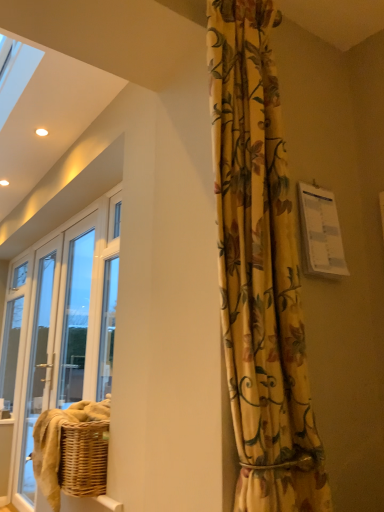
Identify the location of floral yellow curtain at center. This screenshot has height=512, width=384. (260, 269).

In order to face floral yellow curtain at center, should I rotate leftwards or rightwards?

Rotate your view right by about 7.946°.

What do you see at coordinates (260, 269) in the screenshot? Image resolution: width=384 pixels, height=512 pixels. I see `floral yellow curtain at center` at bounding box center [260, 269].

In order to click on clear glass screen door at left in this screenshot , I will do `click(39, 354)`.

What do you see at coordinates (39, 354) in the screenshot?
I see `clear glass screen door at left` at bounding box center [39, 354].

This screenshot has width=384, height=512. In order to click on floral yellow curtain at center in this screenshot , I will do `click(260, 269)`.

Considering the positions of objects clear glass screen door at left and floral yellow curtain at center in the image provided, who is more to the left, clear glass screen door at left or floral yellow curtain at center?

Positioned to the left is clear glass screen door at left.

Which is behind, clear glass screen door at left or floral yellow curtain at center?

Positioned behind is clear glass screen door at left.

Is point (31, 346) positioned after point (240, 220)?

Yes, it is behind point (240, 220).

From the image's perspective, which is above, clear glass screen door at left or floral yellow curtain at center?

From the image's view, floral yellow curtain at center is above.

From a real-world perspective, is clear glass screen door at left physically below floral yellow curtain at center?

Yes, from a real-world perspective, clear glass screen door at left is below floral yellow curtain at center.

Considering the relative sizes of clear glass screen door at left and floral yellow curtain at center in the image provided, is clear glass screen door at left thinner than floral yellow curtain at center?

Correct, the width of clear glass screen door at left is less than that of floral yellow curtain at center.

Considering the relative sizes of clear glass screen door at left and floral yellow curtain at center in the image provided, is clear glass screen door at left shorter than floral yellow curtain at center?

In fact, clear glass screen door at left may be taller than floral yellow curtain at center.

Considering the relative sizes of clear glass screen door at left and floral yellow curtain at center in the image provided, is clear glass screen door at left smaller than floral yellow curtain at center?

No.

Is clear glass screen door at left outside of floral yellow curtain at center?

clear glass screen door at left lies outside floral yellow curtain at center's area.

Is clear glass screen door at left far away from floral yellow curtain at center?

Yes, clear glass screen door at left is far from floral yellow curtain at center.

Is clear glass screen door at left aimed at floral yellow curtain at center?

No, clear glass screen door at left does not turn towards floral yellow curtain at center.

Measure the distance between clear glass screen door at left and floral yellow curtain at center.

They are 2.48 meters apart.

There is a clear glass screen door at left. At what (x,y) coordinates should I click in order to perform the action: click on curtain above it (from a real-world perspective). Please return your answer as a coordinate pair (x, y). This screenshot has width=384, height=512. Looking at the image, I should click on (260, 269).

Between floral yellow curtain at center and clear glass screen door at left, which one appears on the right side from the viewer's perspective?

Positioned to the right is floral yellow curtain at center.

Which object is closer to the camera, floral yellow curtain at center or clear glass screen door at left?

floral yellow curtain at center is in front.

Which is closer to the camera, [259,392] or [24,475]?

The point [259,392] is more forward.

From the image's perspective, is floral yellow curtain at center above clear glass screen door at left?

Yes, from the image's perspective, floral yellow curtain at center is above clear glass screen door at left.

From a real-world perspective, between floral yellow curtain at center and clear glass screen door at left, who is vertically lower?

In real-world perspective, clear glass screen door at left is lower.

Considering the sizes of objects floral yellow curtain at center and clear glass screen door at left in the image provided, who is wider, floral yellow curtain at center or clear glass screen door at left?

With larger width is floral yellow curtain at center.

Looking at this image, between floral yellow curtain at center and clear glass screen door at left, which one has more height?

clear glass screen door at left.

Which of these two, floral yellow curtain at center or clear glass screen door at left, is smaller?

floral yellow curtain at center.

Is floral yellow curtain at center located outside clear glass screen door at left?

floral yellow curtain at center lies outside clear glass screen door at left's area.

Is floral yellow curtain at center next to clear glass screen door at left?

floral yellow curtain at center is not next to clear glass screen door at left, and they're not touching.

Based on the photo, could you tell me if floral yellow curtain at center is facing clear glass screen door at left?

No, floral yellow curtain at center is not oriented towards clear glass screen door at left.

How far apart are floral yellow curtain at center and clear glass screen door at left?

floral yellow curtain at center is 8.13 feet from clear glass screen door at left.

This screenshot has height=512, width=384. In order to click on curtain on the right of clear glass screen door at left in this screenshot , I will do `click(260, 269)`.

Where is `screen door that is under the floral yellow curtain at center (from a real-world perspective)`? screen door that is under the floral yellow curtain at center (from a real-world perspective) is located at coordinates (39, 354).

Identify the location of curtain that is on the right side of clear glass screen door at left. The height and width of the screenshot is (512, 384). [260, 269].